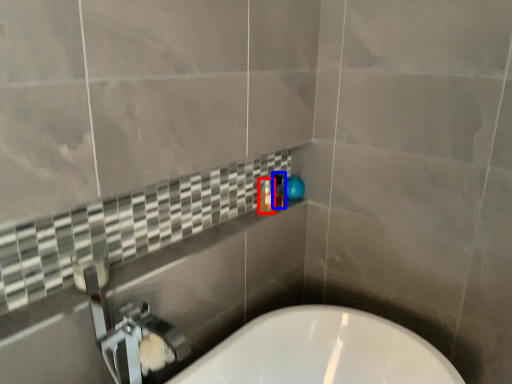
Question: Among these objects, which one is farthest to the camera, bottle (highlighted by a red box) or toiletry (highlighted by a blue box)?

Choices:
 (A) bottle
 (B) toiletry

Answer: (B)